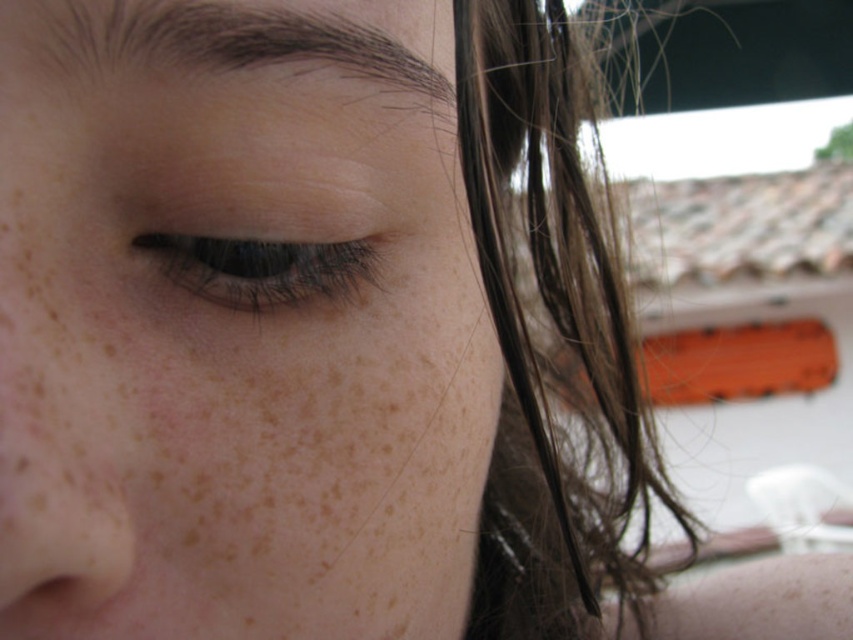
You are holding a small drone that is 2 inches wide. You want to fly it from your current position to the point marked at coordinate point (x=26, y=76) in the image. Can the drone travel the distance without any obstacles?

The distance between the viewer and point (x=26, y=76) is 8.52 inches. Since the drone is 2 inches wide, it can travel this distance as there is no mention of obstacles in the scene description.

You are a photographer adjusting your camera focus. You notice a brown silky hair at right located at point (x=554, y=337). Where exactly is the brown silky hair at right in relation to the person?

The brown silky hair at right is located at point (x=554, y=337), which is to the right side of the person.

You are a photographer adjusting your camera to focus on the brown silky hair at right and the smooth skin nose at lower left. Which object should you focus on first if you want to capture both in sharp detail?

You should focus on the brown silky hair at right first because it is closer to the viewer than the smooth skin nose at lower left, allowing both to be in focus when using a shallow depth of field.